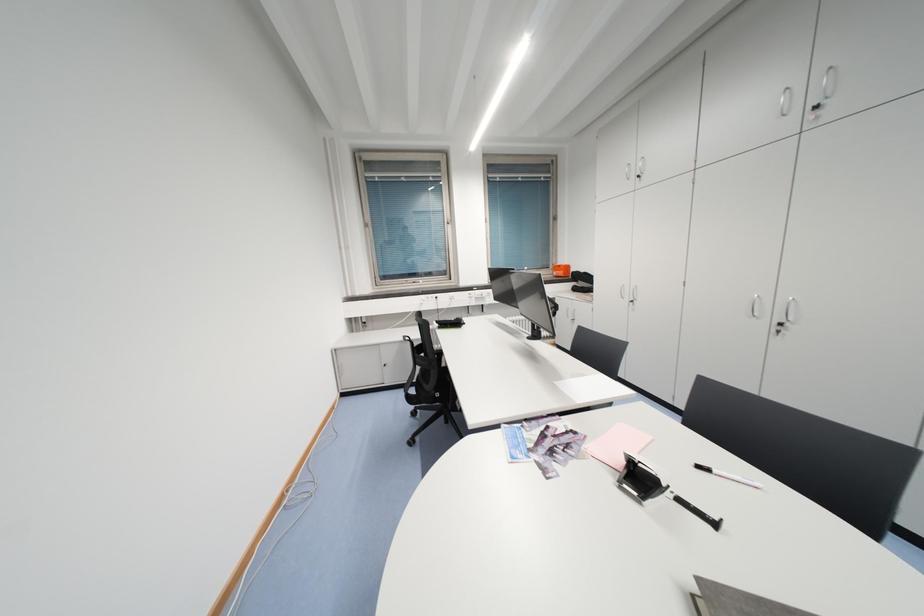
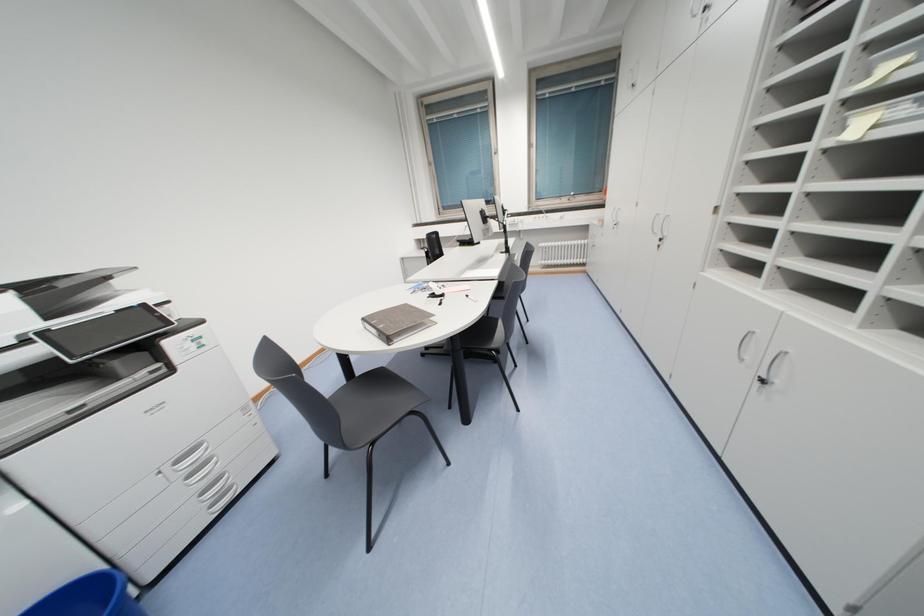
What movement of the cameraman would produce the second image?

The cameraman walked toward right, backward.